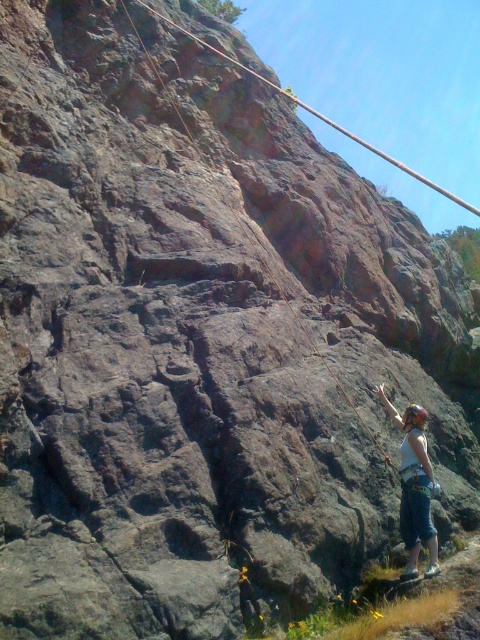
You are a climber assessing the safety of your gear. You notice the white fabric helmet at right and the rusty rock climbing hold at center. Which object is closer to you from your current position?

The white fabric helmet at right is closer to you because it is in front of the rusty rock climbing hold at center.

You are a rock climber who needs to secure your gear. You have a white fabric helmet at right located at point (415, 486). Is the white fabric helmet at right positioned to the right of the climber?

The white fabric helmet at right is located at point (415, 486), which is to the right of the climber.

Based on the scene description, where exactly is the white fabric helmet at right located?

The white fabric helmet at right is located at point (415,486).